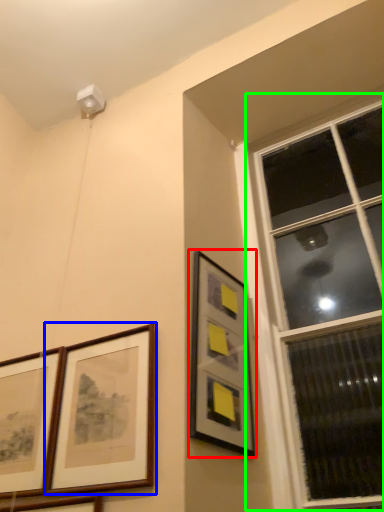
Question: Which is nearer to the picture frame (highlighted by a red box)? picture frame (highlighted by a blue box) or window (highlighted by a green box).

Choices:
 (A) picture frame
 (B) window

Answer: (A)